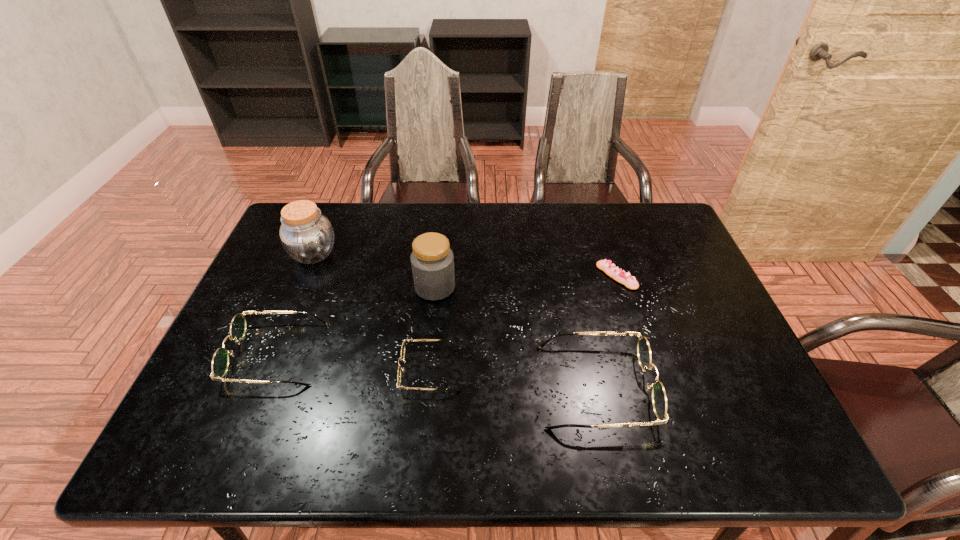
This screenshot has width=960, height=540. Find the location of `free space between the farther jar and the nearer jar`. free space between the farther jar and the nearer jar is located at coordinates (374, 271).

Identify the location of free space that is in between the shortest object and the leftmost spectacles. (446, 315).

Locate an element on the screen. free space between the shortest spectacles and the eclair is located at coordinates (524, 323).

This screenshot has height=540, width=960. In order to click on unoccupied area between the second shortest spectacles and the rightmost spectacles in this screenshot , I will do `click(436, 370)`.

Locate an element on the screen. This screenshot has width=960, height=540. unoccupied position between the rightmost spectacles and the shortest object is located at coordinates (606, 331).

Where is `object that is the second closest to the second tallest spectacles`? object that is the second closest to the second tallest spectacles is located at coordinates (401, 358).

Identify which object is the second nearest to the fifth tallest object. Please provide its 2D coordinates. Your answer should be formatted as a tuple, i.e. [(x, y)], where the tuple contains the x and y coordinates of a point satisfying the conditions above.

[(659, 400)]

At what (x,y) coordinates should I click in order to perform the action: click on the second closest spectacles to the nearer jar. Please return your answer as a coordinate pair (x, y). The width and height of the screenshot is (960, 540). Looking at the image, I should click on (220, 362).

Where is `spectacles that is the second closest to the second spectacles from right to left`? This screenshot has width=960, height=540. spectacles that is the second closest to the second spectacles from right to left is located at coordinates (220, 362).